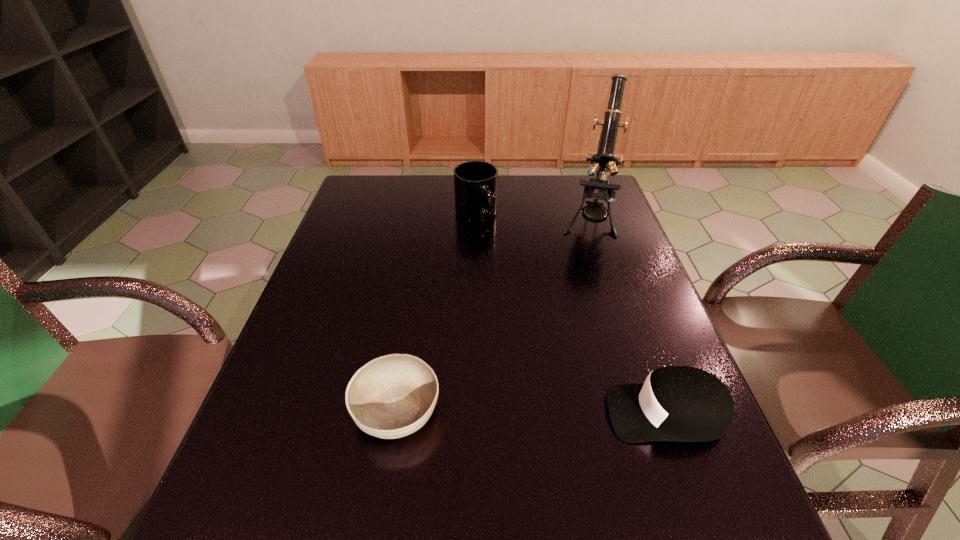
You are a GUI agent. You are given a task and a screenshot of the screen. Output one action in this format:
    pyautogui.click(x=<x>, y=<y>)
    Task: Click on the object at the far right corner
    The image size is (960, 540).
    Given the screenshot: What is the action you would take?
    pyautogui.click(x=604, y=161)

Locate an element on the screen. This screenshot has height=540, width=960. object present at the near right corner is located at coordinates (675, 403).

In the image, there is a desktop. At what (x,y) coordinates should I click in order to perform the action: click on vacant space at the far edge. Please return your answer as a coordinate pair (x, y). This screenshot has height=540, width=960. Looking at the image, I should click on (453, 210).

The width and height of the screenshot is (960, 540). Find the location of `vacant space at the near edge of the desktop`. vacant space at the near edge of the desktop is located at coordinates (518, 446).

You are a GUI agent. You are given a task and a screenshot of the screen. Output one action in this format:
    pyautogui.click(x=<x>, y=<y>)
    Task: Click on the vacant space at the left edge of the desktop
    
    Given the screenshot: What is the action you would take?
    pyautogui.click(x=372, y=215)

Where is `free space at the right edge of the desktop`? free space at the right edge of the desktop is located at coordinates (640, 329).

In the image, there is a desktop. Find the location of `free region at the far left corner`. free region at the far left corner is located at coordinates (372, 191).

This screenshot has width=960, height=540. What are the coordinates of `free space between the bowl and the cap` in the screenshot? It's located at (531, 411).

What are the coordinates of `vacant area that lies between the cap and the microscope` in the screenshot? It's located at [627, 318].

Where is `free space that is in between the third tallest object and the microscope`? This screenshot has height=540, width=960. free space that is in between the third tallest object and the microscope is located at coordinates (627, 318).